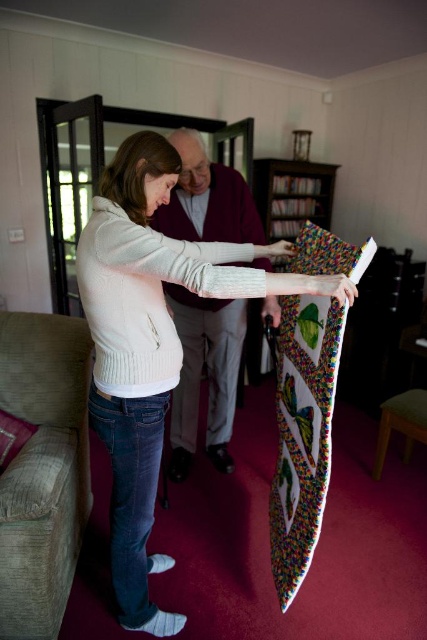
Can you confirm if white knit sweater at center is wider than maroon sweater at center?

Yes, white knit sweater at center is wider than maroon sweater at center.

At what (x,y) coordinates should I click in order to perform the action: click on white knit sweater at center. Please return your answer as a coordinate pair (x, y). The image size is (427, 640). Looking at the image, I should click on (152, 342).